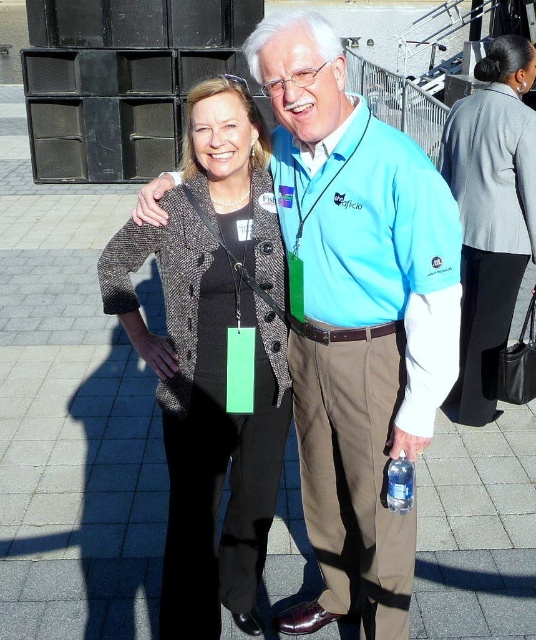
Question: Which of the following is the closest to the observer?

Choices:
 (A) (403, 483)
 (B) (262, 460)
 (C) (364, 429)
 (D) (515, 131)

Answer: (A)

Question: Does textured tweed blazer at center appear under clear plastic bottle at lower right?

Choices:
 (A) no
 (B) yes

Answer: (A)

Question: Based on their relative distances, which object is nearer to the gray wool blazer at upper right?

Choices:
 (A) clear plastic bottle at lower right
 (B) textured tweed blazer at center

Answer: (B)

Question: Is blue fabric shirt at center smaller than gray wool blazer at upper right?

Choices:
 (A) no
 (B) yes

Answer: (A)

Question: Does textured tweed blazer at center have a larger size compared to gray wool blazer at upper right?

Choices:
 (A) no
 (B) yes

Answer: (B)

Question: Which object is closer to the camera taking this photo?

Choices:
 (A) textured tweed blazer at center
 (B) clear plastic bottle at lower right
 (C) blue fabric shirt at center
 (D) gray wool blazer at upper right

Answer: (C)